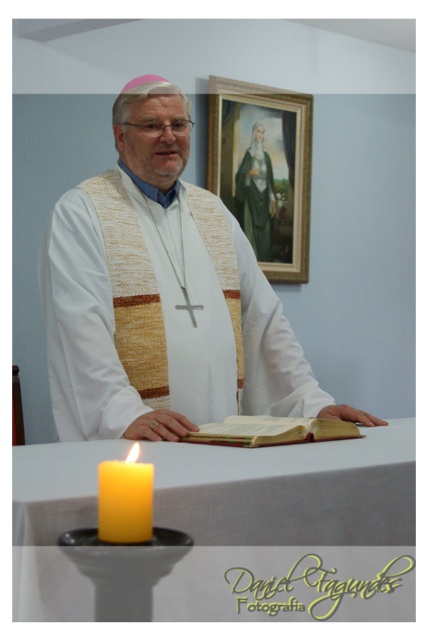
You are standing in front of the table where the open book is placed. There are two points marked on the table surface. The first point is at coordinate point (70, 392) and the second is at point (357, 435). From your perspective, which point is closer to you?

Point (357, 435) is closer to you because it is in front of point (70, 392).

You are an interior designer planning to place a new decorative item between the yellow wax candle at lower left and the green velvet robe at upper center. Based on their positions, where should you place the item to ensure it is between them?

The yellow wax candle at lower left is positioned under the green velvet robe at upper center, so placing the item between them would require positioning it above the candle and below the robe.